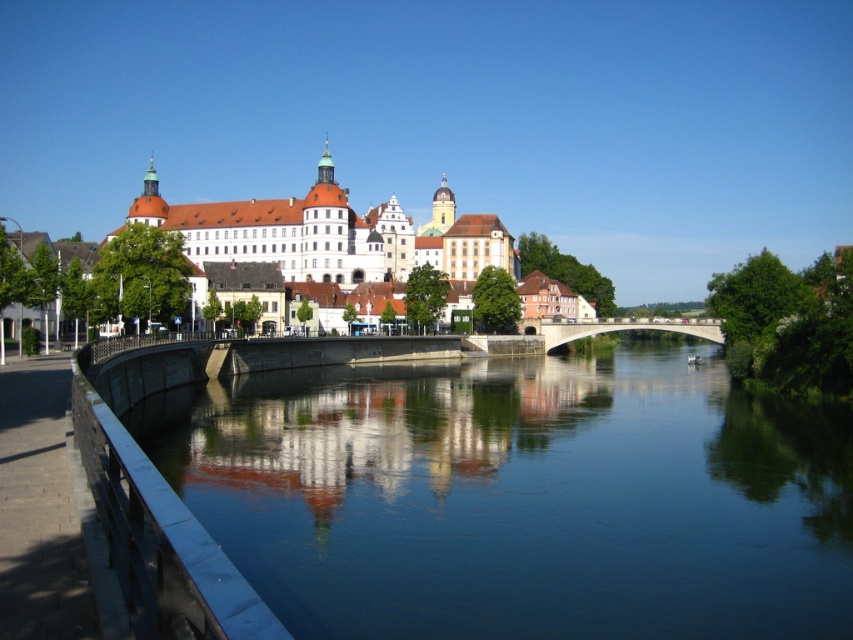
Based on the photo, who is higher up, smooth concrete river at center or white stone castle at center?

Positioned higher is white stone castle at center.

Which is more to the right, smooth concrete river at center or white stone castle at center?

From the viewer's perspective, smooth concrete river at center appears more on the right side.

Between point (514, 433) and point (241, 253), which one is positioned in front?

Positioned in front is point (514, 433).

The image size is (853, 640). I want to click on smooth concrete river at center, so click(520, 497).

Can you confirm if white stone castle at center is positioned above concrete bridge at center?

Correct, white stone castle at center is located above concrete bridge at center.

Can you confirm if white stone castle at center is taller than concrete bridge at center?

Yes.

Does point (354, 232) lie in front of point (705, 321)?

That is False.

The image size is (853, 640). What are the coordinates of `white stone castle at center` in the screenshot? It's located at (328, 232).

Between smooth concrete river at center and concrete bridge at center, which one is positioned higher?

concrete bridge at center

Is smooth concrete river at center in front of concrete bridge at center?

That is True.

Find the location of a particular element. The image size is (853, 640). smooth concrete river at center is located at coordinates (520, 497).

Find the location of a particular element. The width and height of the screenshot is (853, 640). smooth concrete river at center is located at coordinates (520, 497).